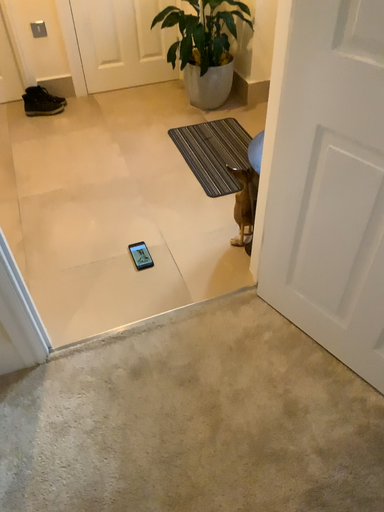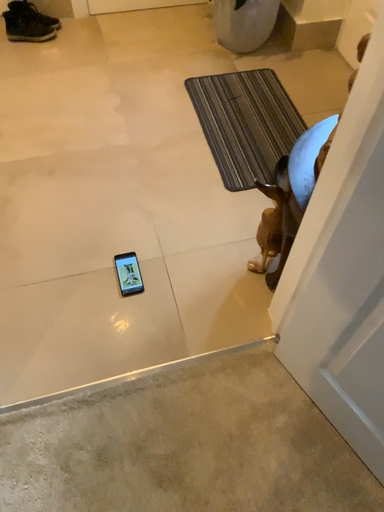
Question: How did the camera likely rotate when shooting the video?

Choices:
 (A) rotated upward
 (B) rotated downward

Answer: (B)